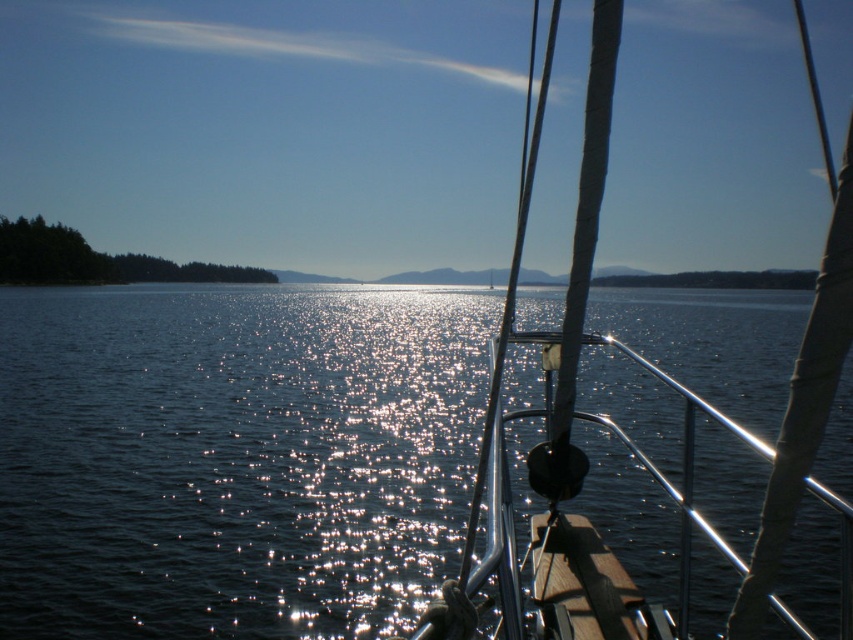
Question: Does sparkling blue water at center come in front of white matte sailboat at center?

Choices:
 (A) no
 (B) yes

Answer: (A)

Question: Which of the following is the farthest from the observer?

Choices:
 (A) (509, 557)
 (B) (447, 360)

Answer: (B)

Question: Can you confirm if sparkling blue water at center is wider than white matte sailboat at center?

Choices:
 (A) no
 (B) yes

Answer: (B)

Question: Does sparkling blue water at center appear on the left side of white matte sailboat at center?

Choices:
 (A) yes
 (B) no

Answer: (A)